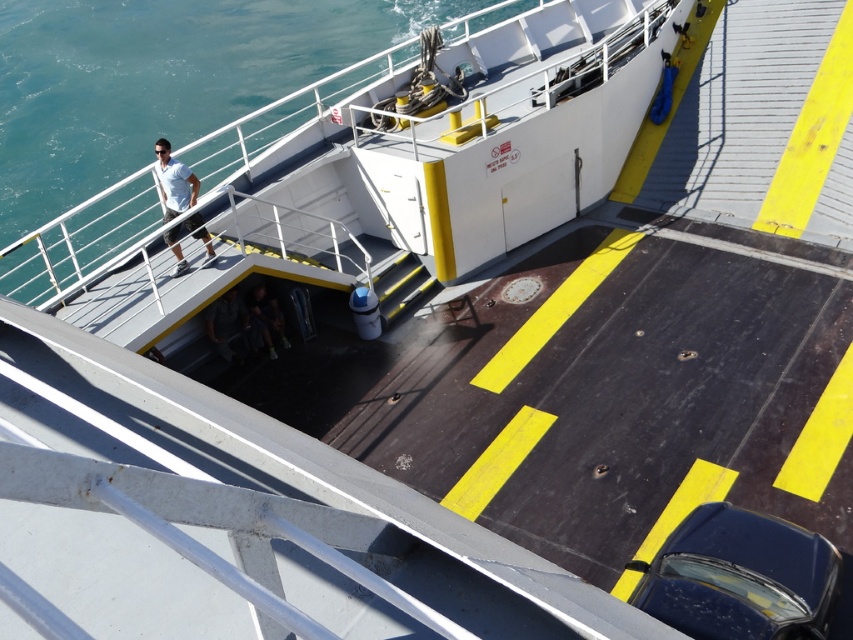
You are navigating a drone to capture aerial footage of the ferry. The drone must avoid the blue water at upper left located at coordinates point 0.350, 0.131. What area should the drone avoid?

The drone should avoid the blue water at upper left, which is located at coordinates point (x=111, y=224).

From the picture: You are a tour guide on the ferry and need to move from the glossy dark blue car at lower right to the dark gray fabric jacket at lower center. Is the distance between them sufficient for you to walk comfortably without needing to detour around any obstacles?

The distance between the glossy dark blue car at lower right and the dark gray fabric jacket at lower center is 29.48 feet, which is more than enough space for a tour guide to walk comfortably without needing to detour around obstacles.

You are on a ferry and want to know if the glossy dark blue car at lower right can fit through a doorway that is the same height as the dark gray fabric jacket at lower center. Can it pass through?

The glossy dark blue car at lower right is not as tall as the dark gray fabric jacket at lower center, so it can pass through the doorway.